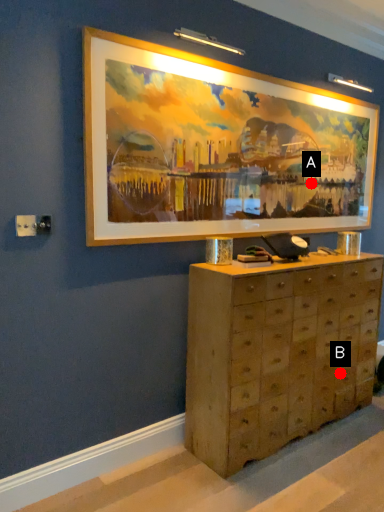
Question: Two points are circled on the image, labeled by A and B beside each circle. Which point is farther from the camera taking this photo?

Choices:
 (A) A is further
 (B) B is further

Answer: (A)